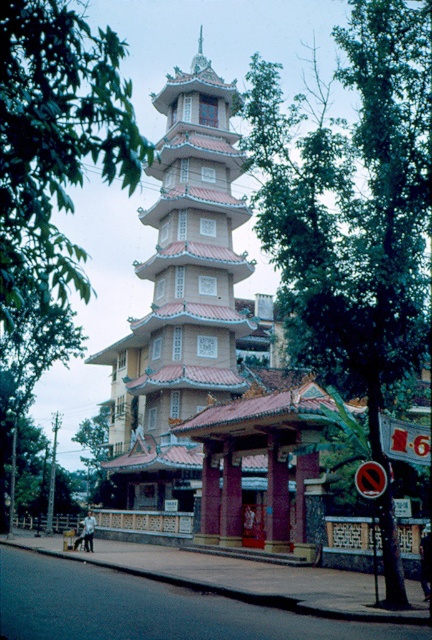
Question: Which point is farther to the camera?

Choices:
 (A) (371, 68)
 (B) (216, 124)
 (C) (64, 109)

Answer: (B)

Question: Is green leafy tree at center positioned in front of green leafy tree at upper left?

Choices:
 (A) yes
 (B) no

Answer: (B)

Question: Which point is closer to the camera?

Choices:
 (A) matte red gate at center
 (B) green leafy tree at upper left
 (C) beige textured pagoda at center
 (D) green leafy tree at center

Answer: (B)

Question: Which point is farther to the camera?

Choices:
 (A) green leafy tree at upper left
 (B) matte red gate at center
 (C) green leafy tree at center

Answer: (B)

Question: Does green leafy tree at upper left appear under matte red gate at center?

Choices:
 (A) yes
 (B) no

Answer: (B)

Question: Can you confirm if beige textured pagoda at center is positioned to the left of matte red gate at center?

Choices:
 (A) yes
 (B) no

Answer: (A)